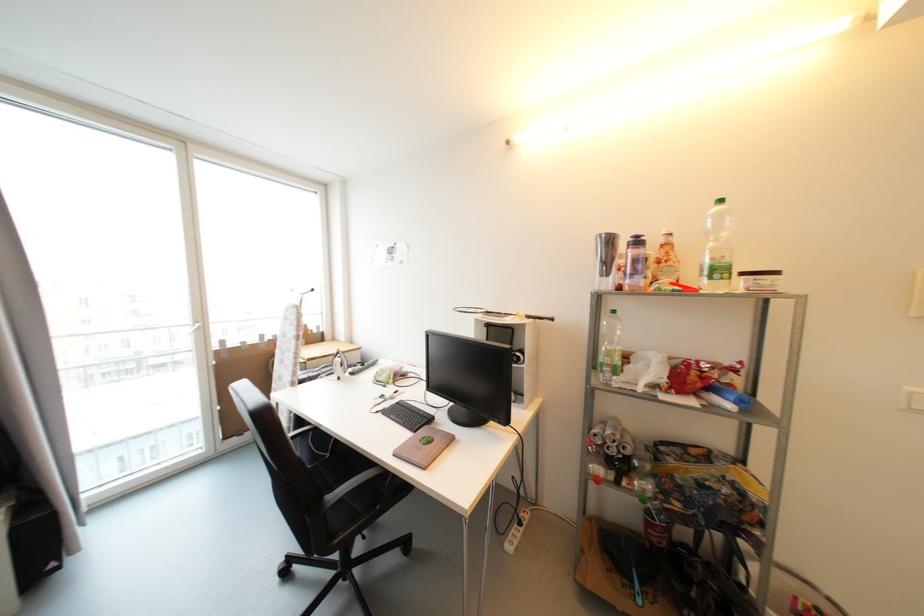
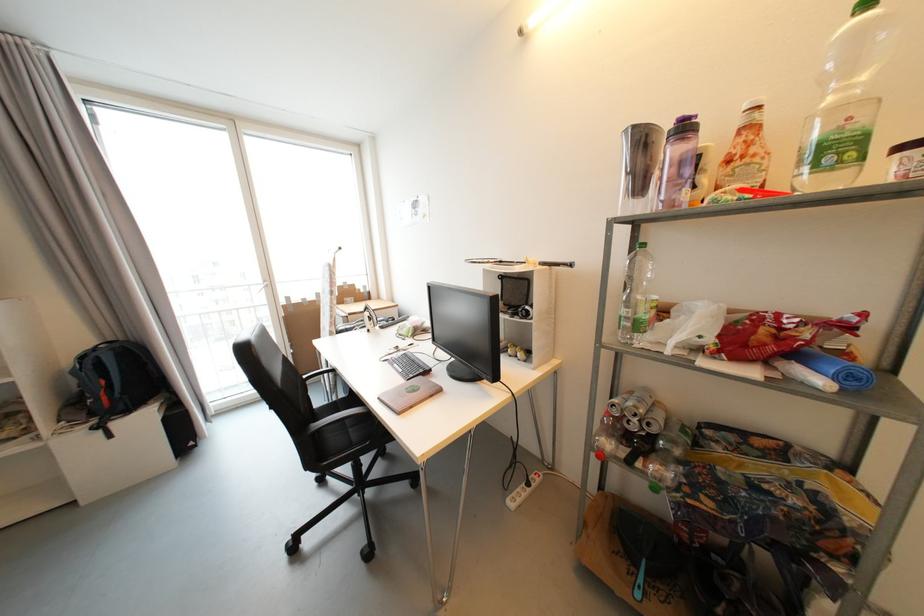
The point at (723, 273) is marked in the first image. Where is the corresponding point in the second image?

(842, 151)